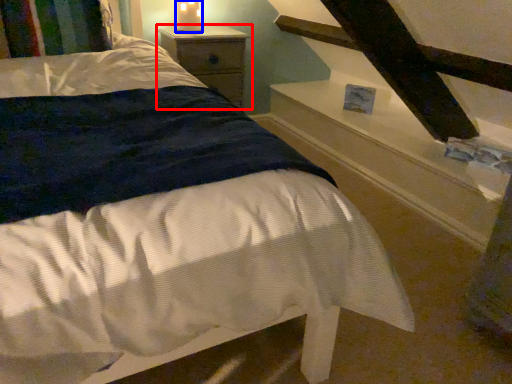
Question: Which of the following is the closest to the observer, nightstand (highlighted by a red box) or candle holder (highlighted by a blue box)?

Choices:
 (A) nightstand
 (B) candle holder

Answer: (A)